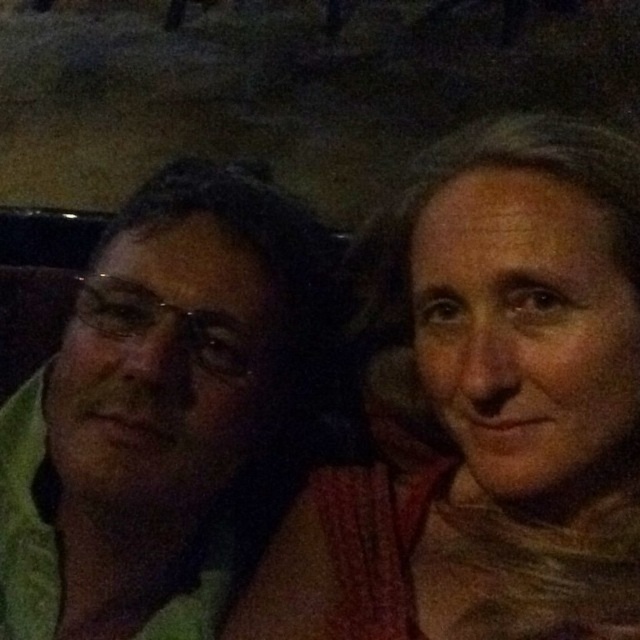
Who is more forward, (x=538, y=144) or (x=150, y=310)?

Positioned in front is point (x=538, y=144).

Image resolution: width=640 pixels, height=640 pixels. I want to click on smooth beige scarf at right, so click(x=483, y=406).

The image size is (640, 640). Identify the location of smooth beige scarf at right. (483, 406).